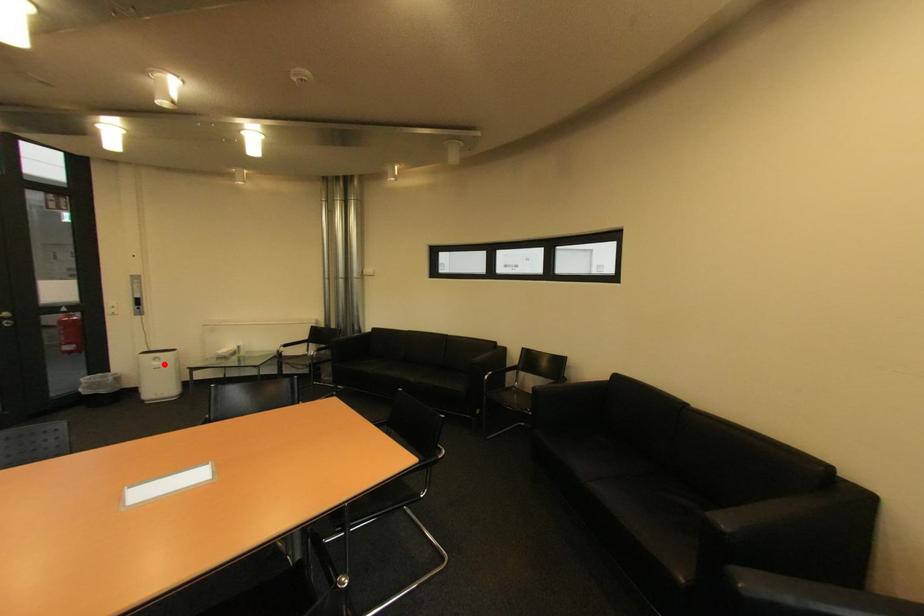
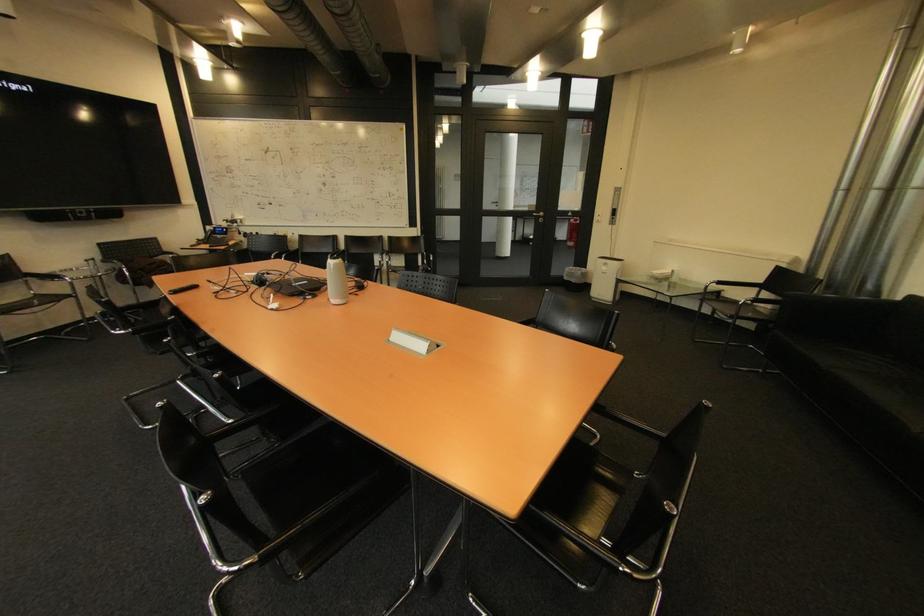
Find the pixel in the second image that matches the highlighted location in the first image.

(613, 270)